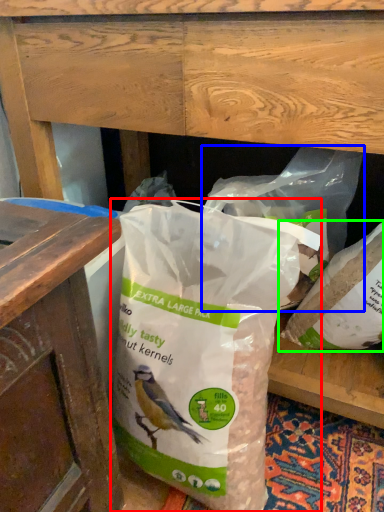
Question: Based on their relative distances, which object is farther from plastic bag (highlighted by a red box)? Choose from plastic bag (highlighted by a blue box) and plastic bag (highlighted by a green box).

Choices:
 (A) plastic bag
 (B) plastic bag

Answer: (B)